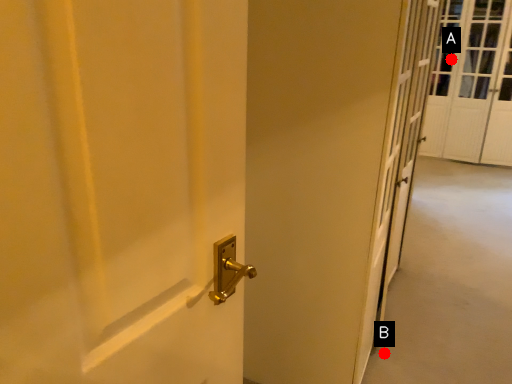
Question: Two points are circled on the image, labeled by A and B beside each circle. Which point is further to the camera?

Choices:
 (A) A is further
 (B) B is further

Answer: (A)